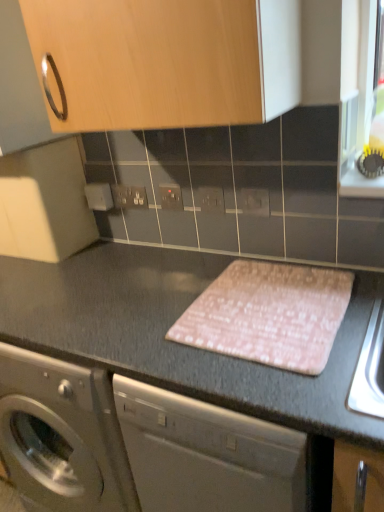
Describe the element at coordinates (269, 315) in the screenshot. I see `pink fabric at center` at that location.

Image resolution: width=384 pixels, height=512 pixels. Find the location of `matte gray electric outlet at center, the 4th electric outlet positioned from the back`. matte gray electric outlet at center, the 4th electric outlet positioned from the back is located at coordinates (255, 201).

Describe the element at coordinates (210, 199) in the screenshot. This screenshot has width=384, height=512. I see `white plastic electric outlet at center, which ranks as the second electric outlet in front-to-back order` at that location.

Measure the distance between wooden cabinet at upper center and camera.

The distance of wooden cabinet at upper center from camera is 30.71 inches.

What do you see at coordinates (171, 197) in the screenshot? Image resolution: width=384 pixels, height=512 pixels. I see `matte plastic electrical outlet at center, acting as the 2th electric outlet starting from the back` at bounding box center [171, 197].

Where is `pink fabric at center`? The image size is (384, 512). pink fabric at center is located at coordinates (269, 315).

Is white plastic electrical outlet at center, which is counted as the first electric outlet, starting from the back, bigger or smaller than matte plastic electrical outlet at center, marked as the 2th electric outlet in a left-to-right arrangement?

white plastic electrical outlet at center, which is counted as the first electric outlet, starting from the back, is bigger than matte plastic electrical outlet at center, marked as the 2th electric outlet in a left-to-right arrangement.

Image resolution: width=384 pixels, height=512 pixels. What are the coordinates of `electric outlet above the matte plastic electrical outlet at center, marked as the 2th electric outlet in a left-to-right arrangement (from the image's perspective)` in the screenshot? It's located at (129, 196).

Is white plastic electrical outlet at center, which is counted as the first electric outlet, starting from the back, at the left side of matte plastic electrical outlet at center, marked as the 2th electric outlet in a left-to-right arrangement?

Yes.

Is white plastic electrical outlet at center, which is counted as the first electric outlet, starting from the back, oriented away from matte plastic electrical outlet at center, marked as the 2th electric outlet in a left-to-right arrangement?

No.

From the image's perspective, is matte plastic electrical outlet at center, acting as the 2th electric outlet starting from the back, located beneath white plastic electric outlet at center, which ranks as the 3th electric outlet in left-to-right order?

No, from the image's perspective, matte plastic electrical outlet at center, acting as the 2th electric outlet starting from the back, is not beneath white plastic electric outlet at center, which ranks as the 3th electric outlet in left-to-right order.

Which is behind, point (169, 197) or point (211, 197)?

The point (169, 197) is farther from the camera.

You are a GUI agent. You are given a task and a screenshot of the screen. Output one action in this format:
    pyautogui.click(x=<x>, y=<y>)
    Task: Click on the electric outlet above the white plastic electric outlet at center, marked as the 2th electric outlet in a right-to-left arrangement (from a real-world perspective)
    
    Given the screenshot: What is the action you would take?
    pyautogui.click(x=171, y=197)

Based on the photo, between matte plastic electrical outlet at center, marked as the 2th electric outlet in a left-to-right arrangement, and white plastic electric outlet at center, which ranks as the 3th electric outlet in left-to-right order, which one has less height?

white plastic electric outlet at center, which ranks as the 3th electric outlet in left-to-right order.

Considering the relative sizes of pink fabric placemat at center and white plastic electric outlet at center, which ranks as the second electric outlet in front-to-back order, in the image provided, is pink fabric placemat at center taller than white plastic electric outlet at center, which ranks as the second electric outlet in front-to-back order,?

Indeed, pink fabric placemat at center has a greater height compared to white plastic electric outlet at center, which ranks as the second electric outlet in front-to-back order.

From the image's perspective, is pink fabric placemat at center under white plastic electric outlet at center, marked as the 2th electric outlet in a right-to-left arrangement?

Correct, pink fabric placemat at center appears lower than white plastic electric outlet at center, marked as the 2th electric outlet in a right-to-left arrangement, in the image.

Is pink fabric placemat at center next to white plastic electric outlet at center, which ranks as the second electric outlet in front-to-back order, and touching it?

No, pink fabric placemat at center is not touching white plastic electric outlet at center, which ranks as the second electric outlet in front-to-back order.

How much distance is there between pink fabric placemat at center and white plastic electric outlet at center, the third electric outlet viewed from the back?

They are 19.22 inches apart.

Is wooden cabinet at upper center at the right side of white plastic electrical outlet at center, which is counted as the first electric outlet, starting from the back?

Indeed, wooden cabinet at upper center is positioned on the right side of white plastic electrical outlet at center, which is counted as the first electric outlet, starting from the back.

From the image's perspective, which is above, wooden cabinet at upper center or white plastic electrical outlet at center, which is the first electric outlet from left to right?

From the image's view, wooden cabinet at upper center is above.

Which object is further away from the camera taking this photo, wooden cabinet at upper center or white plastic electrical outlet at center, which is the first electric outlet from left to right?

white plastic electrical outlet at center, which is the first electric outlet from left to right, is further from the camera.

Does wooden cabinet at upper center turn towards white plastic electrical outlet at center, which is counted as the first electric outlet, starting from the back?

No, wooden cabinet at upper center is not aimed at white plastic electrical outlet at center, which is counted as the first electric outlet, starting from the back.

Which of these two, white plastic electric outlet at center, marked as the 2th electric outlet in a right-to-left arrangement, or white plastic electrical outlet at center, which is counted as the first electric outlet, starting from the back, is wider?

white plastic electrical outlet at center, which is counted as the first electric outlet, starting from the back.

From the image's perspective, is white plastic electric outlet at center, which ranks as the 3th electric outlet in left-to-right order, under white plastic electrical outlet at center, which is counted as the first electric outlet, starting from the back?

Correct, white plastic electric outlet at center, which ranks as the 3th electric outlet in left-to-right order, appears lower than white plastic electrical outlet at center, which is counted as the first electric outlet, starting from the back, in the image.

Is white plastic electric outlet at center, which ranks as the 3th electric outlet in left-to-right order, with white plastic electrical outlet at center, which is the first electric outlet from left to right?

white plastic electric outlet at center, which ranks as the 3th electric outlet in left-to-right order, and white plastic electrical outlet at center, which is the first electric outlet from left to right, are not in contact.

Considering the sizes of white plastic electric outlet at center, which ranks as the second electric outlet in front-to-back order, and white plastic electrical outlet at center, arranged as the 4th electric outlet when viewed from the front, in the image, is white plastic electric outlet at center, which ranks as the second electric outlet in front-to-back order, taller or shorter than white plastic electrical outlet at center, arranged as the 4th electric outlet when viewed from the front,?

white plastic electric outlet at center, which ranks as the second electric outlet in front-to-back order, is taller than white plastic electrical outlet at center, arranged as the 4th electric outlet when viewed from the front.

Between point (120, 310) and point (247, 304), which one is positioned behind?

The point (120, 310) is more distant.

Is pink fabric at center located within pink fabric placemat at center?

Definitely not — pink fabric at center is not inside pink fabric placemat at center.

Consider the image. Which is more to the left, pink fabric placemat at center or pink fabric at center?

pink fabric placemat at center.

Is pink fabric placemat at center further to camera compared to pink fabric at center?

That is False.

Are pink fabric placemat at center and matte gray electric outlet at center, arranged as the first electric outlet when viewed from the right, far apart?

No, pink fabric placemat at center is in close proximity to matte gray electric outlet at center, arranged as the first electric outlet when viewed from the right.

How distant is pink fabric placemat at center from matte gray electric outlet at center, arranged as the first electric outlet when viewed from the right?

The distance of pink fabric placemat at center from matte gray electric outlet at center, arranged as the first electric outlet when viewed from the right, is 19.96 inches.

From a real-world perspective, which is physically below, pink fabric placemat at center or matte gray electric outlet at center, arranged as the first electric outlet when viewed from the right?

pink fabric placemat at center is physically lower.

Considering the sizes of objects pink fabric placemat at center and matte gray electric outlet at center, arranged as the first electric outlet when viewed from the right, in the image provided, who is taller, pink fabric placemat at center or matte gray electric outlet at center, arranged as the first electric outlet when viewed from the right,?

With more height is pink fabric placemat at center.

This screenshot has height=512, width=384. Find the location of `the 1st electric outlet counting from the right of the white plastic electrical outlet at center, which is counted as the first electric outlet, starting from the back`. the 1st electric outlet counting from the right of the white plastic electrical outlet at center, which is counted as the first electric outlet, starting from the back is located at coordinates (171, 197).

The height and width of the screenshot is (512, 384). I want to click on the 1st electric outlet above the white plastic electric outlet at center, which ranks as the 3th electric outlet in left-to-right order (from the image's perspective), so click(171, 197).

When comparing their distances from pink fabric at center, does matte plastic electrical outlet at center, the 3th electric outlet in the right-to-left sequence, or matte gray electric outlet at center, marked as the first electric outlet in a front-to-back arrangement, seem closer?

Based on the image, matte gray electric outlet at center, marked as the first electric outlet in a front-to-back arrangement, appears to be nearer to pink fabric at center.

Considering their positions, is matte plastic electrical outlet at center, the 3th electric outlet in the right-to-left sequence, positioned further to matte gray electric outlet at center, arranged as the first electric outlet when viewed from the right, than pink fabric at center?

Based on the image, pink fabric at center appears to be further to matte gray electric outlet at center, arranged as the first electric outlet when viewed from the right.

Consider the image. Considering their positions, is matte plastic electrical outlet at center, acting as the 2th electric outlet starting from the back, positioned closer to white plastic electric outlet at center, marked as the 2th electric outlet in a right-to-left arrangement, than white plastic electrical outlet at center, which is the first electric outlet from left to right?

matte plastic electrical outlet at center, acting as the 2th electric outlet starting from the back, lies closer to white plastic electric outlet at center, marked as the 2th electric outlet in a right-to-left arrangement, than the other object.

Considering their positions, is pink fabric at center positioned closer to white plastic electric outlet at center, which ranks as the 3th electric outlet in left-to-right order, than white plastic electrical outlet at center, positioned as the fourth electric outlet in right-to-left order?

The object closer to white plastic electric outlet at center, which ranks as the 3th electric outlet in left-to-right order, is white plastic electrical outlet at center, positioned as the fourth electric outlet in right-to-left order.

Based on their spatial positions, is wooden cabinet at upper center or matte plastic electrical outlet at center, acting as the 3th electric outlet starting from the front, closer to pink fabric placemat at center?

The object closer to pink fabric placemat at center is matte plastic electrical outlet at center, acting as the 3th electric outlet starting from the front.

Estimate the real-world distances between objects in this image. Which object is closer to pink fabric placemat at center, white plastic electrical outlet at center, which is the first electric outlet from left to right, or matte plastic electrical outlet at center, marked as the 2th electric outlet in a left-to-right arrangement?

matte plastic electrical outlet at center, marked as the 2th electric outlet in a left-to-right arrangement.

Looking at this image, when comparing their distances from wooden cabinet at upper center, does white plastic electrical outlet at center, arranged as the 4th electric outlet when viewed from the front, or white plastic electric outlet at center, which ranks as the second electric outlet in front-to-back order, seem further?

white plastic electrical outlet at center, arranged as the 4th electric outlet when viewed from the front, is positioned further to the anchor wooden cabinet at upper center.

Based on their spatial positions, is matte plastic electrical outlet at center, marked as the 2th electric outlet in a left-to-right arrangement, or white plastic electrical outlet at center, which is the first electric outlet from left to right, further from pink fabric placemat at center?

The object further to pink fabric placemat at center is white plastic electrical outlet at center, which is the first electric outlet from left to right.

You are a GUI agent. You are given a task and a screenshot of the screen. Output one action in this format:
    pyautogui.click(x=<x>, y=<y>)
    Task: Click on the blanket positioned between wooden cabinet at upper center and white plastic electrical outlet at center, which is counted as the first electric outlet, starting from the back, from near to far
    
    Given the screenshot: What is the action you would take?
    tap(269, 315)

This screenshot has height=512, width=384. I want to click on blanket that lies between matte plastic electrical outlet at center, acting as the 3th electric outlet starting from the front, and pink fabric placemat at center from top to bottom, so click(269, 315).

Where is `electric outlet that lies between white plastic electric outlet at center, the third electric outlet viewed from the back, and pink fabric placemat at center from top to bottom`? electric outlet that lies between white plastic electric outlet at center, the third electric outlet viewed from the back, and pink fabric placemat at center from top to bottom is located at coordinates (255, 201).

You are a GUI agent. You are given a task and a screenshot of the screen. Output one action in this format:
    pyautogui.click(x=<x>, y=<y>)
    Task: Click on the electric outlet between matte plastic electrical outlet at center, acting as the 3th electric outlet starting from the front, and matte gray electric outlet at center, marked as the first electric outlet in a front-to-back arrangement, in the horizontal direction
    This screenshot has width=384, height=512.
    Given the screenshot: What is the action you would take?
    pyautogui.click(x=210, y=199)